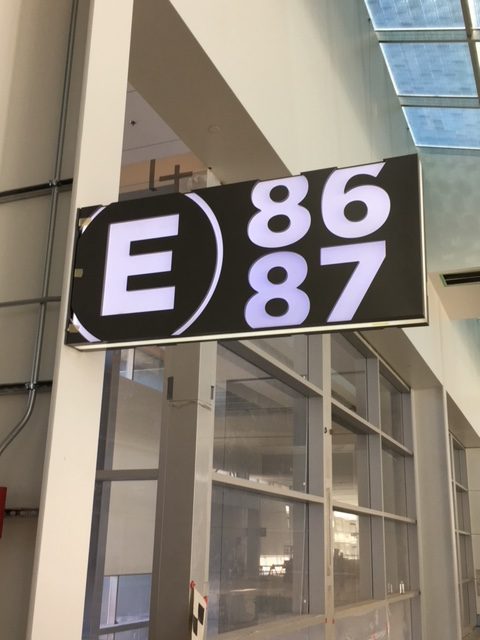
I want to click on light tan beam, so click(431, 489).